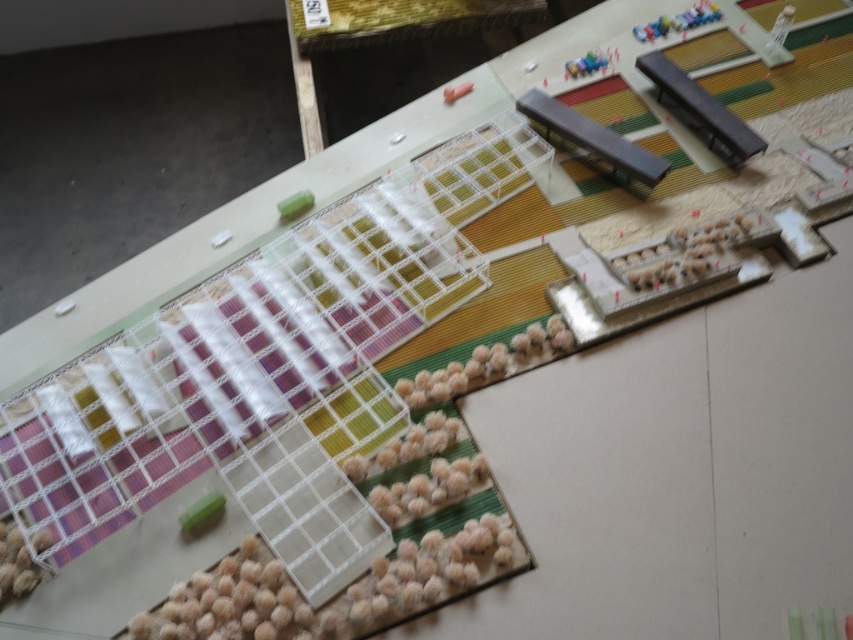
Can you confirm if green plastic toy at lower left is thinner than pink rubber toy at upper center?

Yes.

Does point (199, 515) come behind point (471, 84)?

No.

Locate an element on the screen. green plastic toy at lower left is located at coordinates (201, 513).

Is green matte cube at center-left to the right of pink rubber toy at upper center from the viewer's perspective?

Incorrect, green matte cube at center-left is not on the right side of pink rubber toy at upper center.

Is point (285, 218) positioned in front of point (453, 84)?

Yes, point (285, 218) is in front of point (453, 84).

Identify the location of green matte cube at center-left. (294, 204).

Can you confirm if green plastic toy at lower left is taller than green matte cube at center-left?

Indeed, green plastic toy at lower left has a greater height compared to green matte cube at center-left.

Can you confirm if green plastic toy at lower left is positioned above green matte cube at center-left?

Incorrect, green plastic toy at lower left is not positioned above green matte cube at center-left.

Is point (209, 518) more distant than point (285, 209)?

That is False.

Where is `green plastic toy at lower left`? The width and height of the screenshot is (853, 640). green plastic toy at lower left is located at coordinates (201, 513).